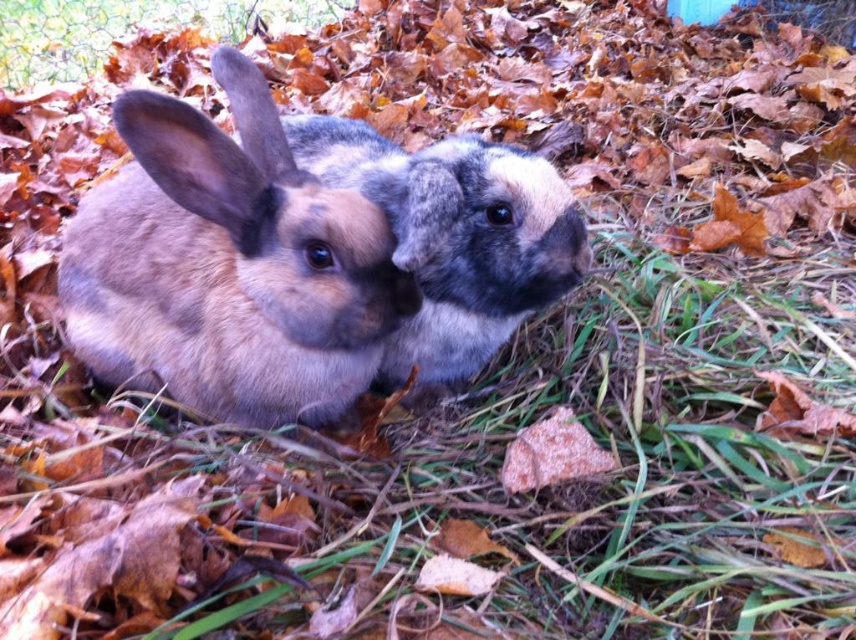
Can you confirm if fuzzy brown rabbit at center is thinner than green grass at upper left?

Yes, fuzzy brown rabbit at center is thinner than green grass at upper left.

Is fuzzy brown rabbit at center to the right of green grass at upper left from the viewer's perspective?

Correct, you'll find fuzzy brown rabbit at center to the right of green grass at upper left.

Is point (485, 182) farther from viewer compared to point (33, 68)?

No, it is not.

The image size is (856, 640). In order to click on fuzzy brown rabbit at center in this screenshot , I will do `click(477, 252)`.

The height and width of the screenshot is (640, 856). I want to click on fuzzy brown rabbit at left, so click(x=229, y=266).

Is fuzzy brown rabbit at left taller than green grass at upper left?

Indeed, fuzzy brown rabbit at left has a greater height compared to green grass at upper left.

Is fuzzy brown rabbit at left below green grass at upper left?

Yes.

At what (x,y) coordinates should I click in order to perform the action: click on fuzzy brown rabbit at left. Please return your answer as a coordinate pair (x, y). Looking at the image, I should click on (229, 266).